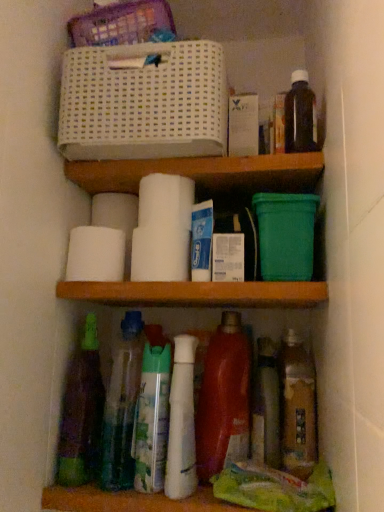
Image resolution: width=384 pixels, height=512 pixels. What are the coordinates of `translucent plastic bottle at lower right, which is counted as the 2th bottle, starting from the right` in the screenshot? It's located at (297, 406).

What do you see at coordinates (166, 200) in the screenshot? I see `white matte toilet paper at center, placed as the second toilet paper when sorted from back to front` at bounding box center [166, 200].

Measure the distance between translucent plastic spray bottle at lower center, which appears as the third bottle when viewed from the left, and camera.

translucent plastic spray bottle at lower center, which appears as the third bottle when viewed from the left, is 27.24 inches away from camera.

Where is `white glossy bottle at center, the fifth bottle viewed from the right`? The height and width of the screenshot is (512, 384). white glossy bottle at center, the fifth bottle viewed from the right is located at coordinates (182, 422).

What do you see at coordinates (224, 399) in the screenshot?
I see `shiny red plastic bottle at lower center, marked as the fourth bottle in a right-to-left arrangement` at bounding box center [224, 399].

This screenshot has height=512, width=384. Describe the element at coordinates (160, 254) in the screenshot. I see `white matte toilet paper at center, which is the 1th toilet paper in front-to-back order` at that location.

Locate an element on the screen. This screenshot has width=384, height=512. white matte toilet paper at center, which is counted as the fourth toilet paper, starting from the back is located at coordinates (160, 254).

Find the location of a particular element. The height and width of the screenshot is (512, 384). translucent plastic bottle at lower right, which is counted as the 2th bottle, starting from the right is located at coordinates (297, 406).

At what (x,y) coordinates should I click in order to perform the action: click on basket container located underneath the dark brown glass bottle at upper right, which ranks as the eighth bottle in left-to-right order (from a real-world perspective). Please return your answer as a coordinate pair (x, y). The height and width of the screenshot is (512, 384). Looking at the image, I should click on click(x=143, y=102).

Between dark brown glass bottle at upper right, which ranks as the eighth bottle in left-to-right order, and white plastic basket at upper center, which one appears on the right side from the viewer's perspective?

Positioned to the right is dark brown glass bottle at upper right, which ranks as the eighth bottle in left-to-right order.

Is dark brown glass bottle at upper right, which is the 1th bottle in right-to-left order, far away from white plastic basket at upper center?

No, dark brown glass bottle at upper right, which is the 1th bottle in right-to-left order, is in close proximity to white plastic basket at upper center.

From a real-world perspective, is white matte toilet paper at center, the 3th toilet paper viewed from the back, beneath translucent plastic bottles at center, the second bottle when ordered from left to right?

No.

Based on the photo, which is more to the right, white matte toilet paper at center, the second toilet paper viewed from the front, or translucent plastic bottles at center, the second bottle when ordered from left to right?

translucent plastic bottles at center, the second bottle when ordered from left to right, is more to the right.

Considering the sizes of objects white matte toilet paper at center, the 3th toilet paper viewed from the back, and translucent plastic bottles at center, the second bottle when ordered from left to right, in the image provided, who is smaller, white matte toilet paper at center, the 3th toilet paper viewed from the back, or translucent plastic bottles at center, the second bottle when ordered from left to right,?

With smaller size is white matte toilet paper at center, the 3th toilet paper viewed from the back.

From the image's perspective, which object appears higher, white matte toilet paper at center, the second toilet paper viewed from the front, or translucent plastic bottles at center, the second bottle when ordered from left to right?

white matte toilet paper at center, the second toilet paper viewed from the front, is shown above in the image.

From a real-world perspective, is translucent green bottle at lower left, arranged as the eighth bottle when viewed from the right, positioned over translucent plastic bottle at lower center, placed as the 6th bottle when sorted from left to right, based on gravity?

Indeed, from a real-world perspective, translucent green bottle at lower left, arranged as the eighth bottle when viewed from the right, stands above translucent plastic bottle at lower center, placed as the 6th bottle when sorted from left to right.

Based on the photo, who is bigger, translucent green bottle at lower left, the first bottle when ordered from left to right, or translucent plastic bottle at lower center, placed as the 6th bottle when sorted from left to right?

translucent green bottle at lower left, the first bottle when ordered from left to right.

Does translucent green bottle at lower left, arranged as the eighth bottle when viewed from the right, have a greater height compared to translucent plastic bottle at lower center, the third bottle viewed from the right?

Yes, translucent green bottle at lower left, arranged as the eighth bottle when viewed from the right, is taller than translucent plastic bottle at lower center, the third bottle viewed from the right.

Does point (97, 450) lie behind point (277, 374)?

No, it is in front of (277, 374).

Is dark brown glass bottle at upper right, which ranks as the eighth bottle in left-to-right order, bigger or smaller than white matte toilet paper at center, the first toilet paper viewed from the back?

In the image, dark brown glass bottle at upper right, which ranks as the eighth bottle in left-to-right order, appears to be larger than white matte toilet paper at center, the first toilet paper viewed from the back.

From the image's perspective, which one is positioned higher, dark brown glass bottle at upper right, which is the 1th bottle in right-to-left order, or white matte toilet paper at center, the first toilet paper viewed from the back?

From the image's view, dark brown glass bottle at upper right, which is the 1th bottle in right-to-left order, is above.

Which is correct: dark brown glass bottle at upper right, which ranks as the eighth bottle in left-to-right order, is inside white matte toilet paper at center, the first toilet paper viewed from the back, or outside of it?

dark brown glass bottle at upper right, which ranks as the eighth bottle in left-to-right order, is located beyond the bounds of white matte toilet paper at center, the first toilet paper viewed from the back.

Between dark brown glass bottle at upper right, which is the 1th bottle in right-to-left order, and white matte toilet paper at center, the fourth toilet paper positioned from the front, which one has less height?

With less height is white matte toilet paper at center, the fourth toilet paper positioned from the front.

Which point is more forward, (x=135, y=393) or (x=170, y=459)?

The point (x=170, y=459) is closer to the camera.

Which object is positioned more to the right, translucent plastic bottles at center, marked as the seventh bottle in a right-to-left arrangement, or white glossy bottle at center, which is counted as the fourth bottle, starting from the left?

white glossy bottle at center, which is counted as the fourth bottle, starting from the left.

Between translucent plastic bottles at center, the second bottle when ordered from left to right, and white glossy bottle at center, the fifth bottle viewed from the right, which one has larger size?

Bigger between the two is translucent plastic bottles at center, the second bottle when ordered from left to right.

From a real-world perspective, does translucent plastic bottles at center, the second bottle when ordered from left to right, stand above white glossy bottle at center, which is counted as the fourth bottle, starting from the left?

Correct, in the physical world, translucent plastic bottles at center, the second bottle when ordered from left to right, is higher than white glossy bottle at center, which is counted as the fourth bottle, starting from the left.

Considering the sizes of objects white plastic basket at upper center and white matte tube at center in the image provided, who is thinner, white plastic basket at upper center or white matte tube at center?

Thinner between the two is white matte tube at center.

This screenshot has width=384, height=512. I want to click on toothpaste below the white plastic basket at upper center (from the image's perspective), so click(201, 241).

Looking at this image, is white plastic basket at upper center further to camera compared to white matte tube at center?

No, white plastic basket at upper center is closer to the camera.

From the image's perspective, which bottle is the 4th one below the white matte toilet paper at center, the second toilet paper viewed from the front? Please provide its 2D coordinates.

[(297, 406)]

Considering the relative sizes of translucent plastic bottle at lower right, acting as the seventh bottle starting from the left, and white matte toilet paper at center, the 3th toilet paper viewed from the back, in the image provided, is translucent plastic bottle at lower right, acting as the seventh bottle starting from the left, wider than white matte toilet paper at center, the 3th toilet paper viewed from the back,?

Incorrect, the width of translucent plastic bottle at lower right, acting as the seventh bottle starting from the left, does not surpass that of white matte toilet paper at center, the 3th toilet paper viewed from the back.

How different are the orientations of translucent plastic bottle at lower right, which is counted as the 2th bottle, starting from the right, and white matte toilet paper at center, the second toilet paper viewed from the front, in degrees?

The angular difference between translucent plastic bottle at lower right, which is counted as the 2th bottle, starting from the right, and white matte toilet paper at center, the second toilet paper viewed from the front, is 0.66 degrees.

Is translucent plastic bottle at lower right, acting as the seventh bottle starting from the left, looking in the opposite direction of white matte toilet paper at center, the second toilet paper viewed from the front?

That's not correct — translucent plastic bottle at lower right, acting as the seventh bottle starting from the left, is not looking away from white matte toilet paper at center, the second toilet paper viewed from the front.

I want to click on bottle above the white plastic basket at upper center (from a real-world perspective), so click(x=300, y=115).

Starting from the white matte toilet paper at center, the second toilet paper viewed from the front, which bottle is the 1st one to the right? Please provide its 2D coordinates.

[(122, 406)]

Which object lies further to the anchor point shiny red plastic bottle at lower center, the 5th bottle when ordered from left to right, dark brown glass bottle at upper right, which is the 1th bottle in right-to-left order, or white matte tube at center?

The object further to shiny red plastic bottle at lower center, the 5th bottle when ordered from left to right, is dark brown glass bottle at upper right, which is the 1th bottle in right-to-left order.

Which object lies nearer to the anchor point dark brown glass bottle at upper right, which ranks as the eighth bottle in left-to-right order, translucent plastic bottles at center, the second bottle when ordered from left to right, or white matte tube at center?

white matte tube at center is closer to dark brown glass bottle at upper right, which ranks as the eighth bottle in left-to-right order.

When comparing their distances from white matte toilet paper at center, which is the 1th toilet paper in front-to-back order, does shiny red plastic bottle at lower center, the 5th bottle when ordered from left to right, or white matte toilet paper at center, the first toilet paper viewed from the back, seem closer?

Among the two, white matte toilet paper at center, the first toilet paper viewed from the back, is located nearer to white matte toilet paper at center, which is the 1th toilet paper in front-to-back order.

Estimate the real-world distances between objects in this image. Which object is further from white matte toilet paper at center, the first toilet paper viewed from the back, white matte toilet paper at center, the second toilet paper viewed from the front, or translucent plastic bottle at lower center, the third bottle viewed from the right?

translucent plastic bottle at lower center, the third bottle viewed from the right, is positioned further to the anchor white matte toilet paper at center, the first toilet paper viewed from the back.

Based on their spatial positions, is translucent plastic spray bottle at lower center, positioned as the 6th bottle in right-to-left order, or white glossy bottle at center, the fifth bottle viewed from the right, further from white matte tube at center?

Among the two, translucent plastic spray bottle at lower center, positioned as the 6th bottle in right-to-left order, is located further to white matte tube at center.

Looking at this image, based on their spatial positions, is white matte toilet paper at center, the first toilet paper viewed from the back, or white matte toilet paper at center, which is the third toilet paper in front-to-back order, closer to white glossy bottle at center, the fifth bottle viewed from the right?

The object closer to white glossy bottle at center, the fifth bottle viewed from the right, is white matte toilet paper at center, which is the third toilet paper in front-to-back order.

Which object lies nearer to the anchor point white matte tube at center, white matte toilet paper at center, the fourth toilet paper positioned from the front, or white matte toilet paper at center, the 3th toilet paper viewed from the back?

Among the two, white matte toilet paper at center, the 3th toilet paper viewed from the back, is located nearer to white matte tube at center.

When comparing their distances from white matte tube at center, does white matte toilet paper at center, which is the third toilet paper in front-to-back order, or translucent plastic bottles at center, marked as the seventh bottle in a right-to-left arrangement, seem further?

translucent plastic bottles at center, marked as the seventh bottle in a right-to-left arrangement, is positioned further to the anchor white matte tube at center.

The width and height of the screenshot is (384, 512). In order to click on toothpaste between dark brown glass bottle at upper right, which is the 1th bottle in right-to-left order, and translucent plastic spray bottle at lower center, positioned as the 6th bottle in right-to-left order, in the up-down direction in this screenshot , I will do `click(201, 241)`.

What are the coordinates of `toilet paper between white matte toilet paper at center, which is the 1th toilet paper in front-to-back order, and white glossy bottle at center, which is counted as the fourth bottle, starting from the left, in the up-down direction` in the screenshot? It's located at (95, 255).

This screenshot has height=512, width=384. In order to click on toothpaste that lies between white matte toilet paper at center, the first toilet paper viewed from the back, and translucent plastic spray bottle at lower center, positioned as the 6th bottle in right-to-left order, from top to bottom in this screenshot , I will do `click(201, 241)`.

In order to click on basket container between dark brown glass bottle at upper right, which is the 1th bottle in right-to-left order, and translucent plastic bottle at lower center, the third bottle viewed from the right, in the vertical direction in this screenshot , I will do `click(143, 102)`.